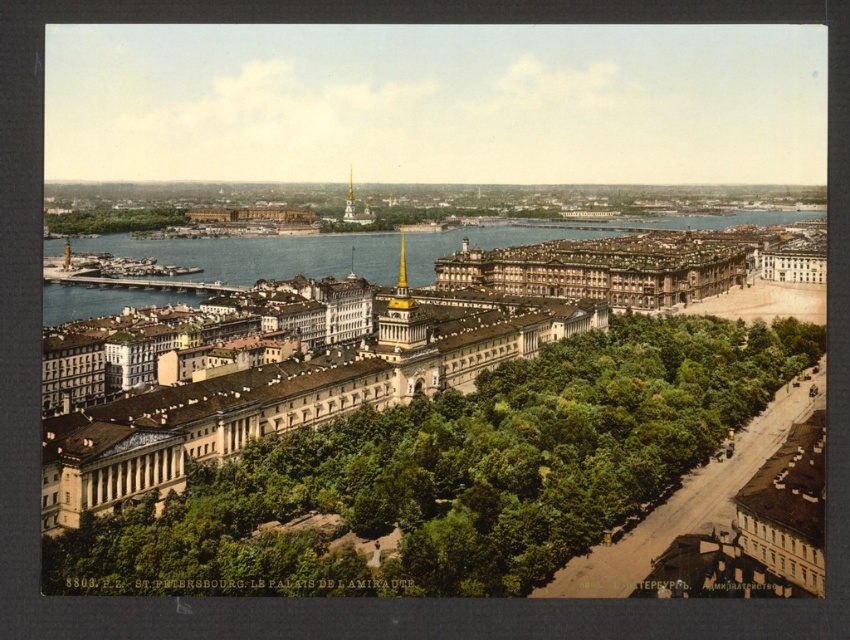
This screenshot has width=850, height=640. Find the location of `white stone palace at center`. white stone palace at center is located at coordinates (289, 396).

Does golden stone palace at center-right have a lesser width compared to green leafy trees at left?

Incorrect, golden stone palace at center-right's width is not less than green leafy trees at left's.

Does golden stone palace at center-right have a smaller size compared to green leafy trees at left?

No, golden stone palace at center-right is not smaller than green leafy trees at left.

Identify the location of golden stone palace at center-right. (604, 268).

Can you confirm if green leafy trees at center is taller than blue water at center?

No, green leafy trees at center is not taller than blue water at center.

In order to click on green leafy trees at center in this screenshot , I will do `click(462, 468)`.

Find the location of a particular element. This screenshot has height=640, width=850. green leafy trees at center is located at coordinates (462, 468).